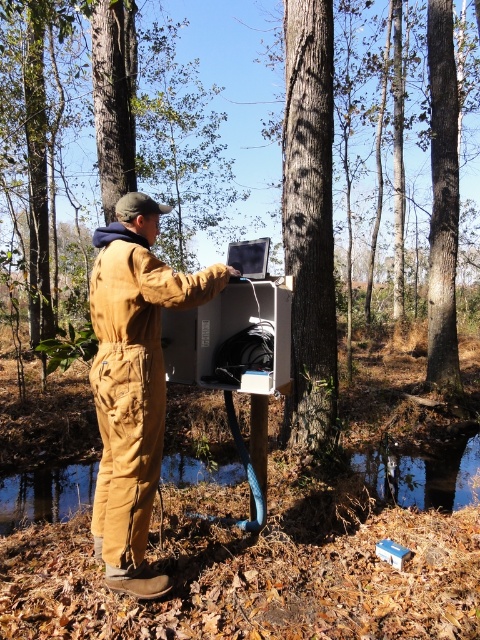
Who is positioned more to the left, brown cotton jumpsuit at center or smooth bark tree at center?

brown cotton jumpsuit at center

Does brown cotton jumpsuit at center have a smaller size compared to smooth bark tree at center?

Correct, brown cotton jumpsuit at center occupies less space than smooth bark tree at center.

Between point (139, 349) and point (325, 324), which one is positioned in front?

Positioned in front is point (139, 349).

Identify the location of brown cotton jumpsuit at center. (133, 381).